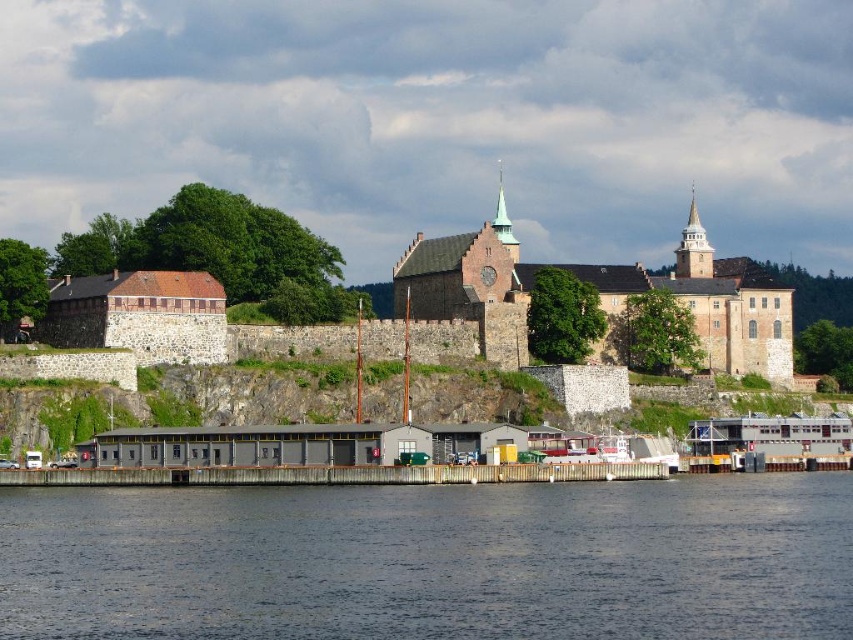
Between point (479, 589) and point (786, 308), which one is positioned behind?

Point (786, 308)

Which of these two, dark blue water at lower center or brown stone fort at center, stands shorter?

dark blue water at lower center

Is point (448, 496) closer to viewer compared to point (740, 348)?

Yes, it is in front of point (740, 348).

What are the coordinates of `dark blue water at lower center` in the screenshot? It's located at (432, 561).